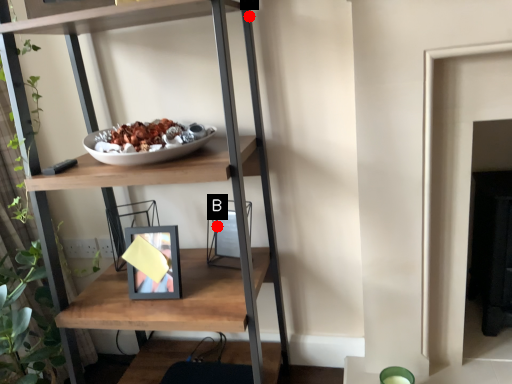
Question: Two points are circled on the image, labeled by A and B beside each circle. Among these points, which one is nearest to the camera?

Choices:
 (A) A is closer
 (B) B is closer

Answer: (A)